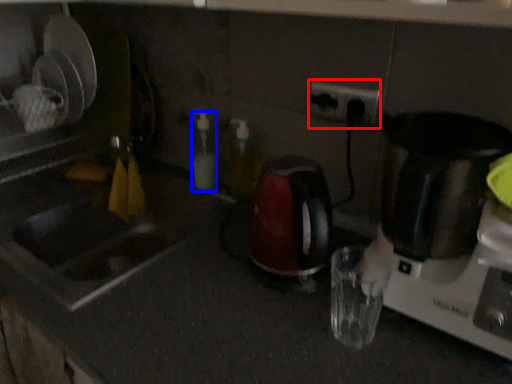
Question: Among these objects, which one is nearest to the camera, electric outlet (highlighted by a red box) or bottle (highlighted by a blue box)?

Choices:
 (A) electric outlet
 (B) bottle

Answer: (A)